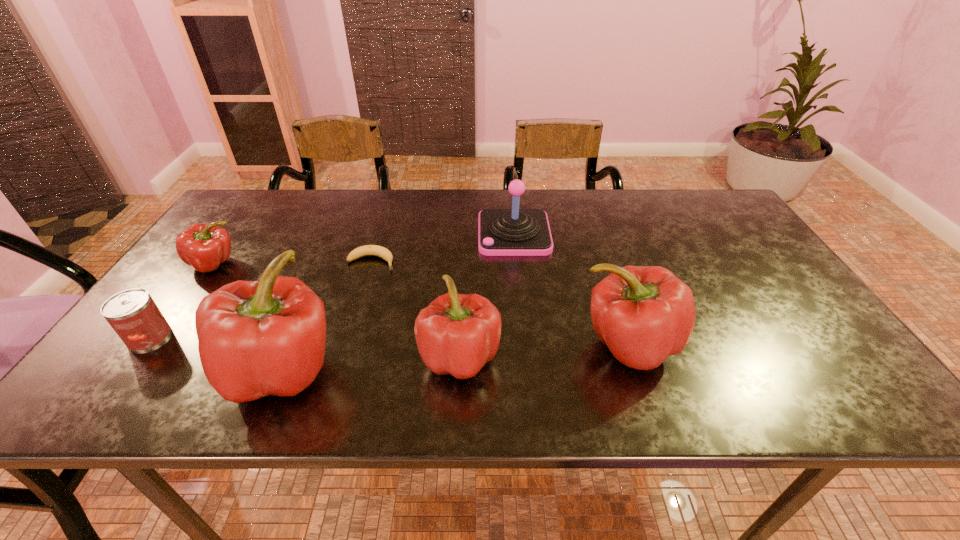
I want to click on the leftmost bell pepper, so click(267, 337).

Locate an element on the screen. This screenshot has width=960, height=540. the second bell pepper from left to right is located at coordinates (456, 334).

Where is `the rightmost object`? The height and width of the screenshot is (540, 960). the rightmost object is located at coordinates (644, 314).

At what (x,y) coordinates should I click in order to perform the action: click on the rightmost bell pepper. Please return your answer as a coordinate pair (x, y). This screenshot has height=540, width=960. Looking at the image, I should click on (644, 314).

At what (x,y) coordinates should I click in order to perform the action: click on pepper. Please return your answer as a coordinate pair (x, y). The height and width of the screenshot is (540, 960). Looking at the image, I should click on [205, 246].

Where is `joystick`? Image resolution: width=960 pixels, height=540 pixels. joystick is located at coordinates (502, 232).

Locate an element on the screen. The image size is (960, 540). banana is located at coordinates (368, 250).

Where is `can`? can is located at coordinates (133, 314).

This screenshot has height=540, width=960. I want to click on vacant space located on the right of the leftmost bell pepper, so click(471, 370).

The image size is (960, 540). Identify the location of vacant space located on the right of the shortest bell pepper. (606, 357).